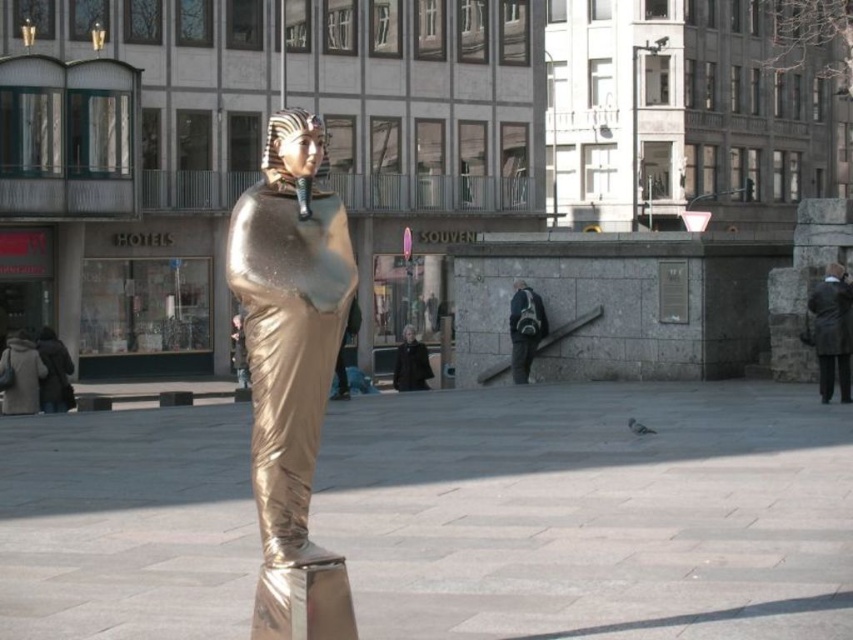
You are a delivery person who needs to place a dark gray backpack at center on the reflective pedestal where the gold metallic statue at center is currently standing. Can you lift the statue and put the backpack there instead?

The gold metallic statue at center might be wider than dark gray backpack at center, so it may be difficult to lift and move the statue due to its size. Check if the pedestal can support the backpack once the statue is removed.

You are standing in the urban scene and want to pick up the brown leather coat at lower right. Considering your height is 1.75 meters, can you comfortably reach it?

The brown leather coat at lower right is 18.07 meters from the viewer. Since it is very far away, you cannot comfortably reach it.

Looking at this image, you are a traveler who just arrived at the urban area. You have a brown leather coat at lower right and a dark gray backpack at center. Which item is taller?

The brown leather coat at lower right is taller than the dark gray backpack at center.